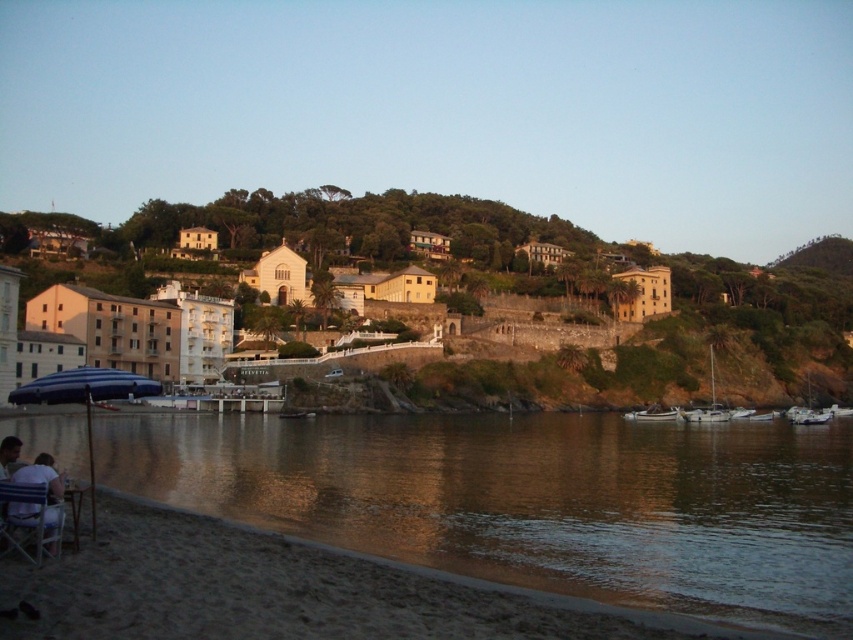
Consider the image. You are standing at the point with coordinates (28, 518). What object are you currently standing on?

The point with coordinates (28, 518) is on the metallic silver beach chair at lower left.

You are standing on the beach and want to take a photo of both the brown reflective water at lower left and the blue matte umbrella at lower left. Which object should you focus on first to ensure both are in the frame?

Since the brown reflective water at lower left is closer to the viewer than the blue matte umbrella at lower left, you should focus on the brown reflective water at lower left first to ensure both are in focus.

You are standing at the center of the stone walkway leading to the buildings. You want to reach the white glossy sailboat at lower right without walking on the sand. Is there a path available that avoids the sandy beach?

The white glossy sailboat at lower right is located at point (711,403), which is near the water edge. Since the stone walkway leads towards the buildings uphill, there is no path directly to the sailboat from the walkway. To reach it without walking on sand, you would need to follow the shoreline or find another path not shown in the scene description.